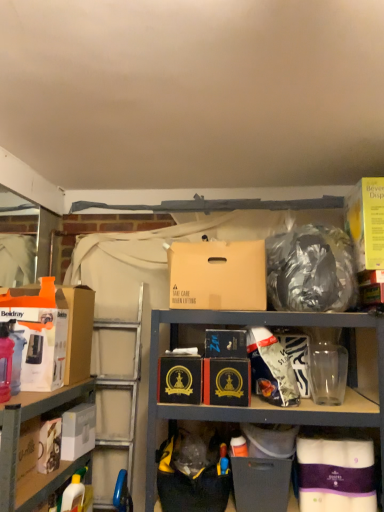
Question: Is matte black box at lower center, which is the 3th box in right-to-left order, further to the viewer compared to translucent plastic bottle at left?

Choices:
 (A) yes
 (B) no

Answer: (A)

Question: Is matte black box at lower center, which is the 3th box in right-to-left order, next to translucent plastic bottle at left?

Choices:
 (A) no
 (B) yes

Answer: (A)

Question: Is matte black box at lower center, the 7th box positioned from the left, oriented towards translucent plastic bottle at left?

Choices:
 (A) yes
 (B) no

Answer: (B)

Question: Can you confirm if matte black box at lower center, which is the 3th box in right-to-left order, is shorter than translucent plastic bottle at left?

Choices:
 (A) no
 (B) yes

Answer: (B)

Question: Is matte black box at lower center, which is the 3th box in right-to-left order, positioned far away from translucent plastic bottle at left?

Choices:
 (A) no
 (B) yes

Answer: (B)

Question: Can translucent plastic bottle at left be found inside matte black box at lower center, the 7th box positioned from the left?

Choices:
 (A) no
 (B) yes

Answer: (A)

Question: Does white matte toilet paper at lower right, marked as the 8th box in a left-to-right arrangement, have a lesser width compared to yellow cardboard beverage dispenser at upper right, which ranks as the 9th box in left-to-right order?

Choices:
 (A) no
 (B) yes

Answer: (B)

Question: From a real-world perspective, is white matte toilet paper at lower right, positioned as the second box in right-to-left order, beneath yellow cardboard beverage dispenser at upper right, which appears as the 1th box when viewed from the right?

Choices:
 (A) yes
 (B) no

Answer: (A)

Question: From the image's perspective, is white matte toilet paper at lower right, positioned as the second box in right-to-left order, over yellow cardboard beverage dispenser at upper right, which ranks as the 9th box in left-to-right order?

Choices:
 (A) no
 (B) yes

Answer: (A)

Question: From a real-world perspective, is white matte toilet paper at lower right, positioned as the second box in right-to-left order, physically above yellow cardboard beverage dispenser at upper right, which ranks as the 9th box in left-to-right order?

Choices:
 (A) yes
 (B) no

Answer: (B)

Question: Is white matte toilet paper at lower right, positioned as the second box in right-to-left order, taller than yellow cardboard beverage dispenser at upper right, which ranks as the 9th box in left-to-right order?

Choices:
 (A) yes
 (B) no

Answer: (B)

Question: Is white matte toilet paper at lower right, marked as the 8th box in a left-to-right arrangement, oriented away from yellow cardboard beverage dispenser at upper right, which appears as the 1th box when viewed from the right?

Choices:
 (A) yes
 (B) no

Answer: (B)

Question: Is black cardboard box at center, which is the third box from left to right, positioned beyond the bounds of yellow cardboard beverage dispenser at upper right, which appears as the 1th box when viewed from the right?

Choices:
 (A) no
 (B) yes

Answer: (B)